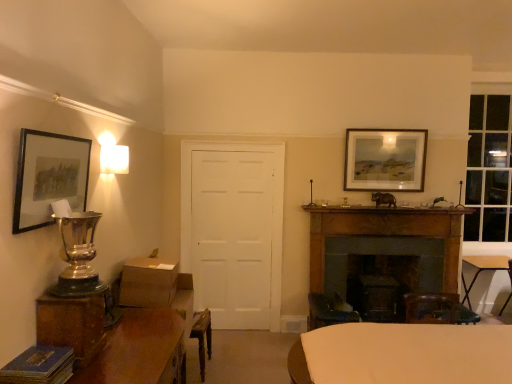
Question: Is wooden table at lower left, the 1th table positioned from the left, wider than white matte door at center?

Choices:
 (A) no
 (B) yes

Answer: (B)

Question: Can you confirm if wooden table at lower left, arranged as the 3th table when viewed from the back, is shorter than white matte door at center?

Choices:
 (A) no
 (B) yes

Answer: (B)

Question: Is wooden table at lower left, the 1th table positioned from the left, positioned beyond the bounds of white matte door at center?

Choices:
 (A) yes
 (B) no

Answer: (A)

Question: Can you see wooden table at lower left, arranged as the first table when viewed from the front, touching white matte door at center?

Choices:
 (A) yes
 (B) no

Answer: (B)

Question: Considering the relative sizes of wooden table at lower left, the third table viewed from the right, and white matte door at center in the image provided, is wooden table at lower left, the third table viewed from the right, taller than white matte door at center?

Choices:
 (A) yes
 (B) no

Answer: (B)

Question: From the image's perspective, is dark brown wood fireplace at center right located above or below white fabric-covered table at center, placed as the second table when sorted from back to front?

Choices:
 (A) below
 (B) above

Answer: (B)

Question: In terms of height, does dark brown wood fireplace at center right look taller or shorter compared to white fabric-covered table at center, the 2th table positioned from the left?

Choices:
 (A) tall
 (B) short

Answer: (A)

Question: Is point (419, 291) closer or farther from the camera than point (428, 337)?

Choices:
 (A) closer
 (B) farther

Answer: (B)

Question: From a real-world perspective, relative to white fabric-covered table at center, which is counted as the 2th table, starting from the right, is dark brown wood fireplace at center right vertically above or below?

Choices:
 (A) below
 (B) above

Answer: (B)

Question: Looking at their shapes, would you say dark brown wood fireplace at center right is wider or thinner than silver metallic trophy at left?

Choices:
 (A) thin
 (B) wide

Answer: (A)

Question: Based on their sizes in the image, would you say dark brown wood fireplace at center right is bigger or smaller than silver metallic trophy at left?

Choices:
 (A) small
 (B) big

Answer: (B)

Question: Considering the positions of dark brown wood fireplace at center right and silver metallic trophy at left in the image, is dark brown wood fireplace at center right taller or shorter than silver metallic trophy at left?

Choices:
 (A) tall
 (B) short

Answer: (A)

Question: From the image's perspective, is dark brown wood fireplace at center right located above or below silver metallic trophy at left?

Choices:
 (A) above
 (B) below

Answer: (B)

Question: Considering the positions of point (504, 256) and point (417, 266), is point (504, 256) closer or farther from the camera than point (417, 266)?

Choices:
 (A) farther
 (B) closer

Answer: (A)

Question: Considering the relative positions of wooden folding table at lower right, the 1th table from the back, and dark brown wood fireplace at center right in the image provided, is wooden folding table at lower right, the 1th table from the back, to the left or to the right of dark brown wood fireplace at center right?

Choices:
 (A) right
 (B) left

Answer: (A)